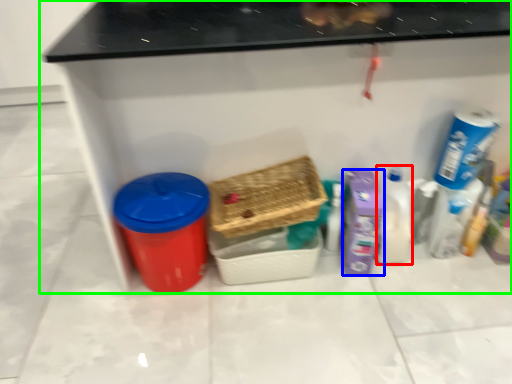
Question: Which object is the closest to the cleaning product (highlighted by a red box)? Choose among these: cleaning product (highlighted by a blue box) or furniture (highlighted by a green box).

Choices:
 (A) cleaning product
 (B) furniture

Answer: (A)